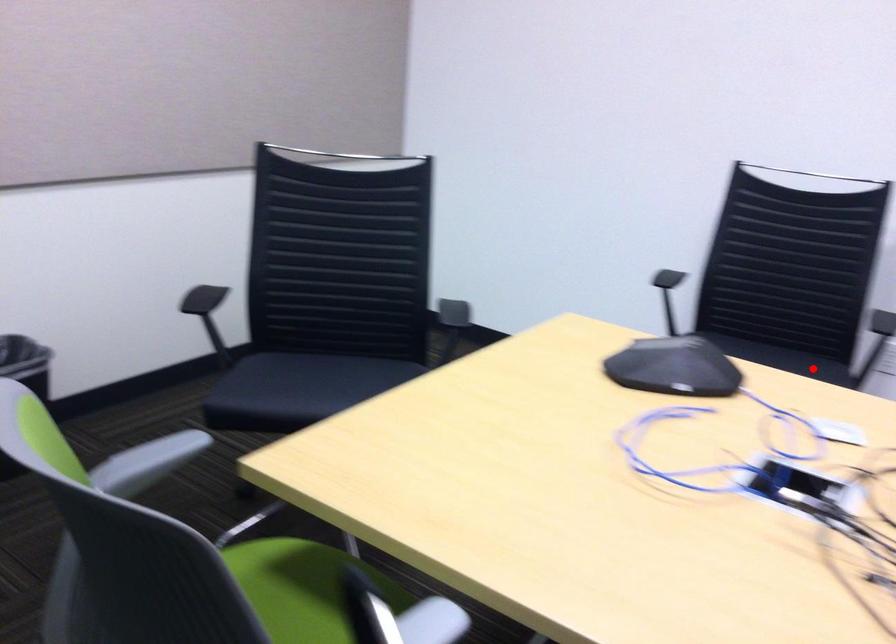
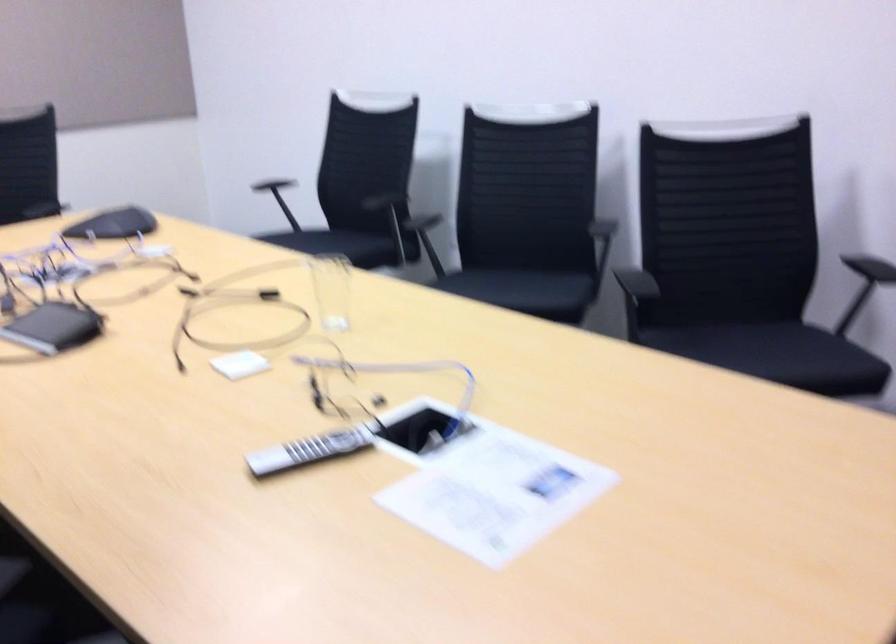
Question: I am providing you with two images of the same scene from different viewpoints. Image1 has a red point marked. In image2, the corresponding 3D location appears at what relative position? Reply with the corresponding letter.

Choices:
 (A) Closer
 (B) Farther

Answer: (B)